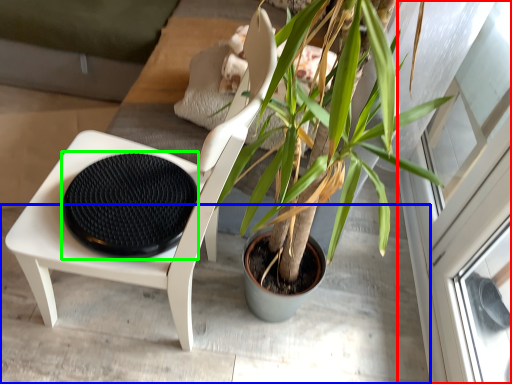
Question: Estimate the real-world distances between objects in this image. Which object is farther from screen door (highlighted by a red box), concrete (highlighted by a blue box) or footrest (highlighted by a green box)?

Choices:
 (A) concrete
 (B) footrest

Answer: (B)